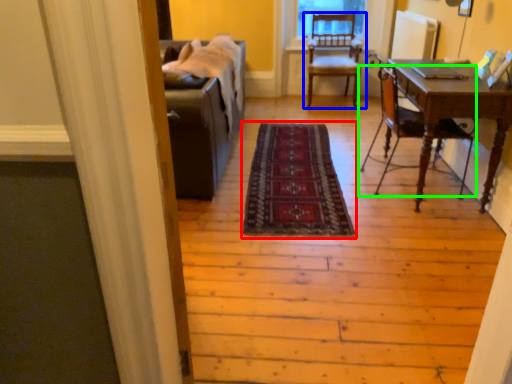
Question: Which is nearer to the mat (highlighted by a red box)? chair (highlighted by a blue box) or chair (highlighted by a green box).

Choices:
 (A) chair
 (B) chair

Answer: (B)